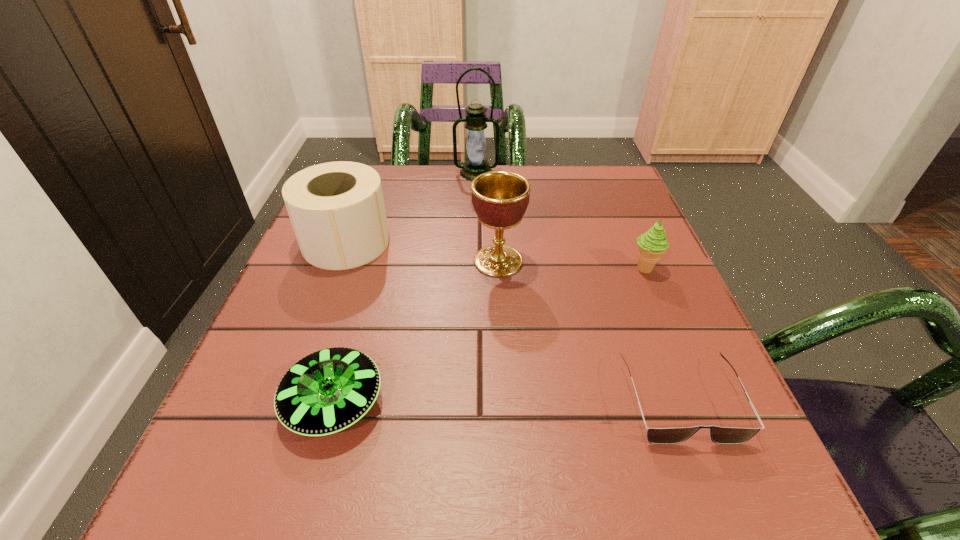
This screenshot has height=540, width=960. Find the location of `the farthest object`. the farthest object is located at coordinates (475, 164).

Find the location of a particular element. Image resolution: width=960 pixels, height=540 pixels. lantern is located at coordinates (475, 164).

I want to click on the fifth shortest object, so click(500, 198).

Image resolution: width=960 pixels, height=540 pixels. Identify the location of toilet tissue. (337, 211).

I want to click on icecream, so click(x=652, y=244).

In order to click on the fifth tallest object in this screenshot , I will do `click(327, 391)`.

This screenshot has height=540, width=960. Find the location of `the shortest object`. the shortest object is located at coordinates (720, 435).

Locate an element on the screen. This screenshot has width=960, height=540. blank space located 0.330m on the side where the farthest object emits light is located at coordinates (475, 262).

The width and height of the screenshot is (960, 540). I want to click on vacant space situated on the left of the chalice, so click(x=341, y=261).

Find the location of a particular element. free space located on the front of the toilet tissue is located at coordinates (266, 459).